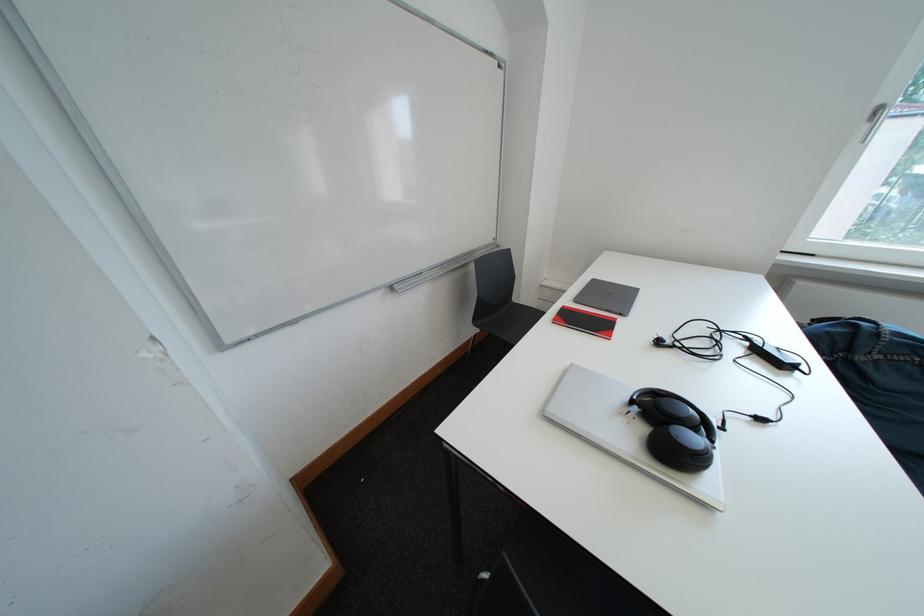
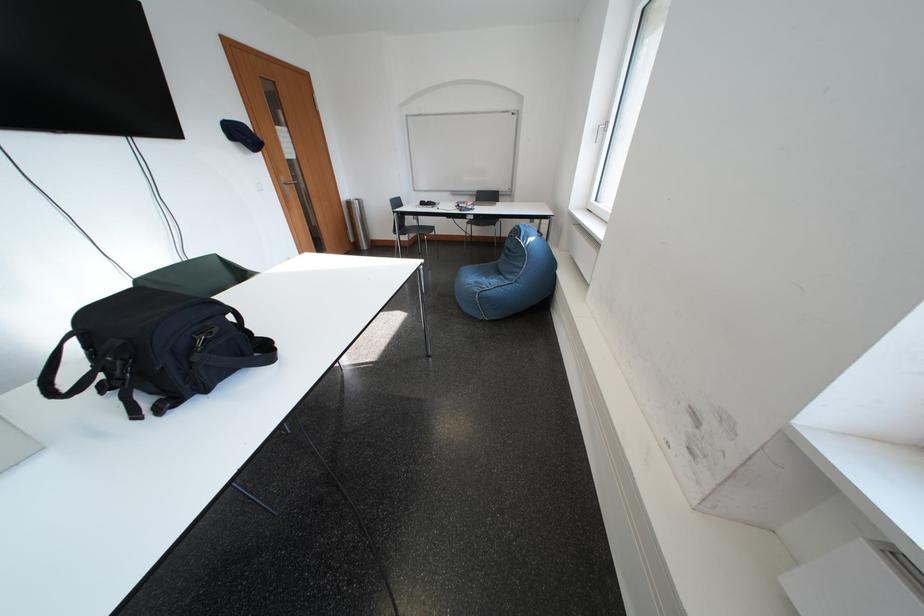
Question: I am providing you with two images of the same scene from different viewpoints. After the viewpoint changes to image2, which objects are now occluded?

Choices:
 (A) washing machine lid
 (B) black headphones
 (C) zipper pull
 (D) silver door handle

Answer: (B)